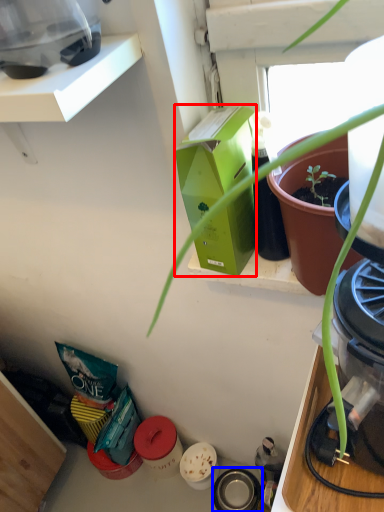
Question: Among these objects, which one is farthest to the camera, box (highlighted by a red box) or appliance (highlighted by a blue box)?

Choices:
 (A) box
 (B) appliance

Answer: (B)